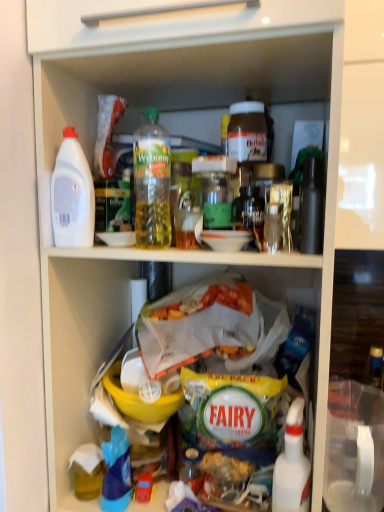
Question: Is blue plastic bottle at lower left further to the viewer compared to green glass jar at center, positioned as the 3th bottle in left-to-right order?

Choices:
 (A) yes
 (B) no

Answer: (A)

Question: From a real-world perspective, does blue plastic bottle at lower left sit lower than green glass jar at center, positioned as the 3th bottle in left-to-right order?

Choices:
 (A) no
 (B) yes

Answer: (B)

Question: Can you confirm if blue plastic bottle at lower left is smaller than green glass jar at center, which is the third bottle in right-to-left order?

Choices:
 (A) yes
 (B) no

Answer: (A)

Question: Is blue plastic bottle at lower left positioned far away from green glass jar at center, positioned as the 3th bottle in left-to-right order?

Choices:
 (A) no
 (B) yes

Answer: (A)

Question: Does blue plastic bottle at lower left appear on the right side of green glass jar at center, positioned as the 3th bottle in left-to-right order?

Choices:
 (A) no
 (B) yes

Answer: (A)

Question: From a real-world perspective, is yellow plastic bowl at center above or below matte brown jar at upper center, which is the fourth bottle in left-to-right order?

Choices:
 (A) below
 (B) above

Answer: (A)

Question: Looking at their shapes, would you say yellow plastic bowl at center is wider or thinner than matte brown jar at upper center, positioned as the 2th bottle in right-to-left order?

Choices:
 (A) wide
 (B) thin

Answer: (B)

Question: Relative to matte brown jar at upper center, positioned as the 2th bottle in right-to-left order, is yellow plastic bowl at center in front or behind?

Choices:
 (A) behind
 (B) front

Answer: (A)

Question: Based on their sizes in the image, would you say yellow plastic bowl at center is bigger or smaller than matte brown jar at upper center, which is the fourth bottle in left-to-right order?

Choices:
 (A) small
 (B) big

Answer: (A)

Question: Which is correct: blue plastic bottle at lower left is inside white plastic bottle at left, which ranks as the 1th bottle in left-to-right order, or outside of it?

Choices:
 (A) outside
 (B) inside

Answer: (A)

Question: Is point (107, 501) positioned closer to the camera than point (64, 174)?

Choices:
 (A) closer
 (B) farther

Answer: (B)

Question: In terms of height, does blue plastic bottle at lower left look taller or shorter compared to white plastic bottle at left, the 5th bottle when ordered from right to left?

Choices:
 (A) tall
 (B) short

Answer: (B)

Question: From the image's perspective, is blue plastic bottle at lower left above or below white plastic bottle at left, the 5th bottle when ordered from right to left?

Choices:
 (A) above
 (B) below

Answer: (B)

Question: Is translucent plastic bottle at upper center, the fourth bottle viewed from the right, wider or thinner than blue plastic bottle at lower left?

Choices:
 (A) wide
 (B) thin

Answer: (A)

Question: In terms of height, does translucent plastic bottle at upper center, the fourth bottle viewed from the right, look taller or shorter compared to blue plastic bottle at lower left?

Choices:
 (A) tall
 (B) short

Answer: (A)